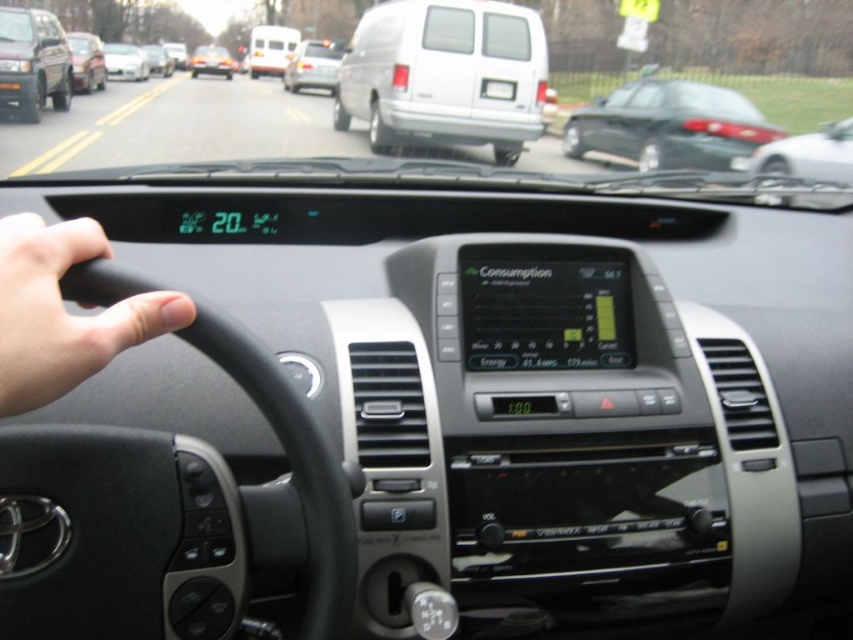
Question: From the image, what is the correct spatial relationship of shiny black sedan at right in relation to white matte sedan at center?

Choices:
 (A) left
 (B) right

Answer: (B)

Question: Is white matte van at center bigger than matte black van at center?

Choices:
 (A) yes
 (B) no

Answer: (B)

Question: Is matte black van at center bigger than matte black sedan at center?

Choices:
 (A) no
 (B) yes

Answer: (A)

Question: Which of the following is the closest to the observer?

Choices:
 (A) (143, 320)
 (B) (103, 54)
 (C) (76, 58)
 (D) (161, 49)

Answer: (A)

Question: Which point is closer to the camera?

Choices:
 (A) (206, 68)
 (B) (834, 125)
 (C) (131, 60)
 (D) (666, 134)

Answer: (D)

Question: Which object is closer to the camera taking this photo?

Choices:
 (A) metallic silver car at right
 (B) silver metallic van at center

Answer: (A)